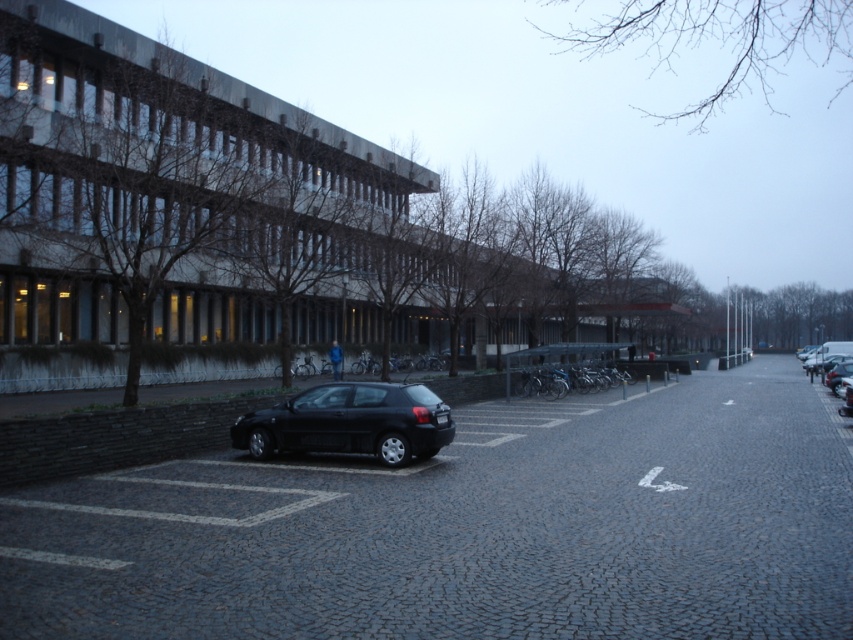
You need to park your compact car in the parking lot shown. The shiny black hatchback at center and the metallic silver car at right are already parked. Which parking spot between them has enough space for your car?

The parking spot between the shiny black hatchback at center and the metallic silver car at right has enough space because the shiny black hatchback at center occupies less space than the metallic silver car at right, so there is more room available between them.